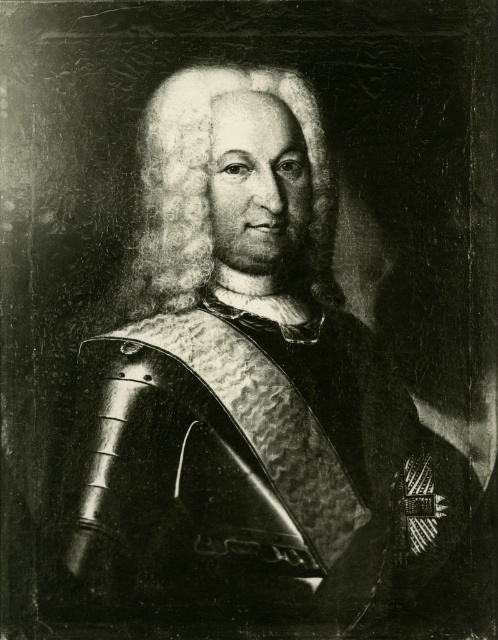
In the scene shown: Between white textured hair at center and white fluffy beard at center, which one appears on the right side from the viewer's perspective?

From the viewer's perspective, white fluffy beard at center appears more on the right side.

Can you confirm if white textured hair at center is positioned to the right of white fluffy beard at center?

In fact, white textured hair at center is to the left of white fluffy beard at center.

The width and height of the screenshot is (498, 640). What are the coordinates of `white textured hair at center` in the screenshot? It's located at (207, 186).